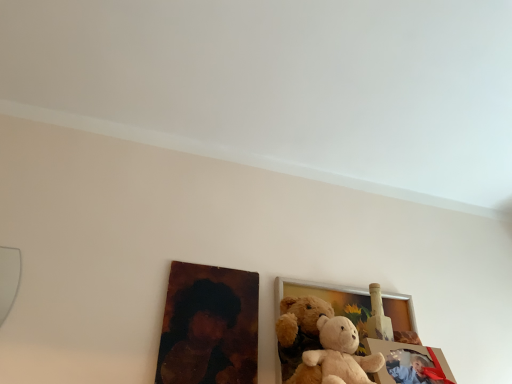
Question: Is wooden photo frame at center, positioned as the 1th picture frame in back-to-front order, in front of or behind oil painting portrait at lower left in the image?

Choices:
 (A) front
 (B) behind

Answer: (B)

Question: From the image's perspective, relative to oil painting portrait at lower left, is wooden photo frame at center, which appears as the 2th picture frame when viewed from the front, above or below?

Choices:
 (A) above
 (B) below

Answer: (B)

Question: Which object is the farthest from the matte plastic picture frame at lower right, acting as the 2th picture frame starting from the back?

Choices:
 (A) oil painting portrait at lower left
 (B) wooden photo frame at center, positioned as the 1th picture frame in back-to-front order
 (C) soft plush teddy bear at center

Answer: (A)

Question: Which object is positioned farthest from the oil painting portrait at lower left?

Choices:
 (A) matte plastic picture frame at lower right, placed as the 1th picture frame when sorted from front to back
 (B) wooden photo frame at center, positioned as the 1th picture frame in back-to-front order
 (C) soft plush teddy bear at center

Answer: (A)